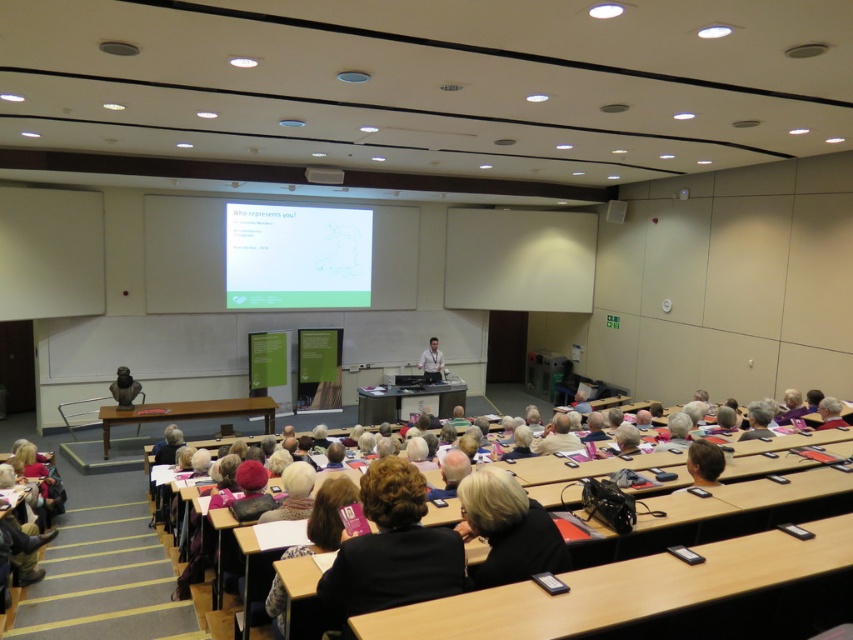
Question: Estimate the real-world distances between objects in this image. Which object is closer to the smooth wooden desk at lower center?

Choices:
 (A) dark gray sweater at center
 (B) white matte projection screen at upper center
 (C) white shirt at center

Answer: (A)

Question: Which point is closer to the camera taking this photo?

Choices:
 (A) (636, 536)
 (B) (479, 486)
 (C) (430, 346)
 (D) (440, 548)

Answer: (D)

Question: Which is farther from the white matte projection screen at upper center?

Choices:
 (A) white matte projector screen at upper center
 (B) matte bronze bust at lower left

Answer: (B)

Question: Can you confirm if white matte projection screen at upper center is smaller than white matte projector screen at upper center?

Choices:
 (A) no
 (B) yes

Answer: (A)

Question: Is white matte projection screen at upper center below dark gray sweater at center?

Choices:
 (A) yes
 (B) no

Answer: (B)

Question: Does white matte projection screen at upper center appear on the right side of dark gray sweater at center?

Choices:
 (A) yes
 (B) no

Answer: (B)